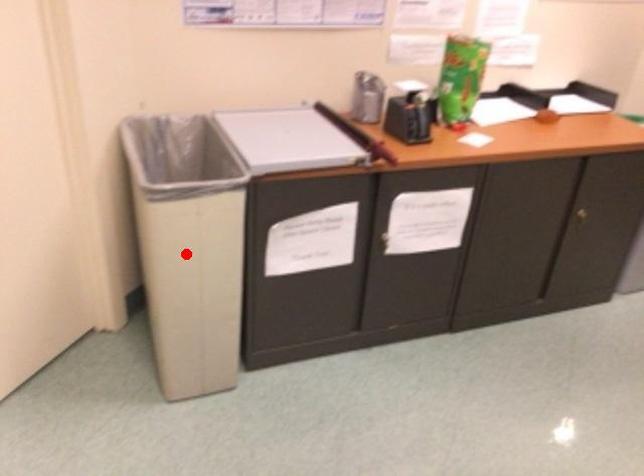
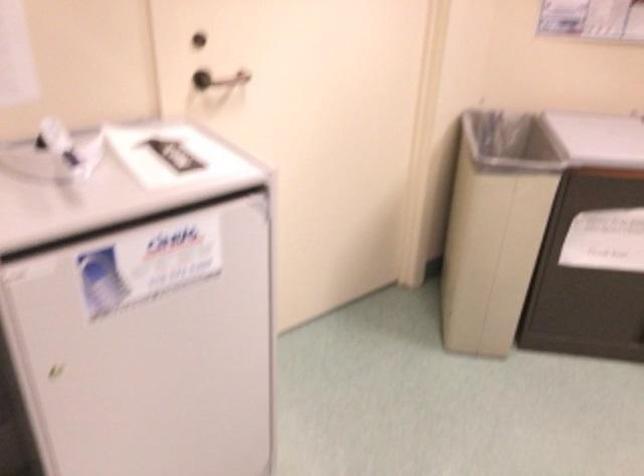
In the second image, find the point that corresponds to the highlighted location in the first image.

(494, 227)